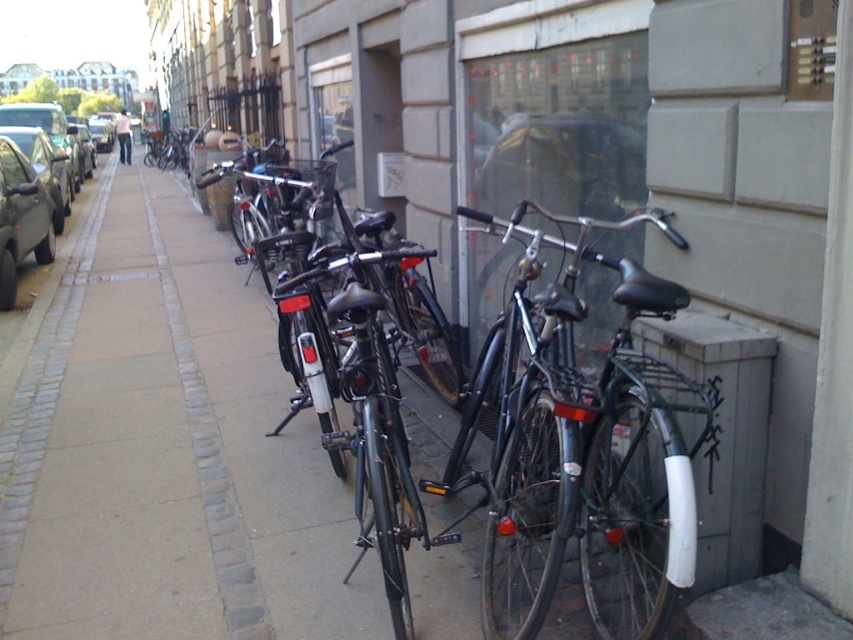
You are a delivery person who needs to park your delivery van, which is 2 meters wide, between the shiny black bicycle at center and the matte black car at left. Based on the scene, can your van fit in the space between them?

The shiny black bicycle at center has a larger width than the matte black car at left. Since the van is 2 meters wide, and the space between them is determined by the width of the wider object, the van cannot fit between them because the bicycle is wider than the car, making the space insufficient.

You are a delivery person who needs to park your shiny silver car at left in a spot that requires the vehicle to be within 5 meters of the camera. Can you park it in this spot?

The shiny silver car at left is currently 7.60 meters away from the camera, which exceeds the 5 meter requirement. Therefore, it cannot be parked in this spot.